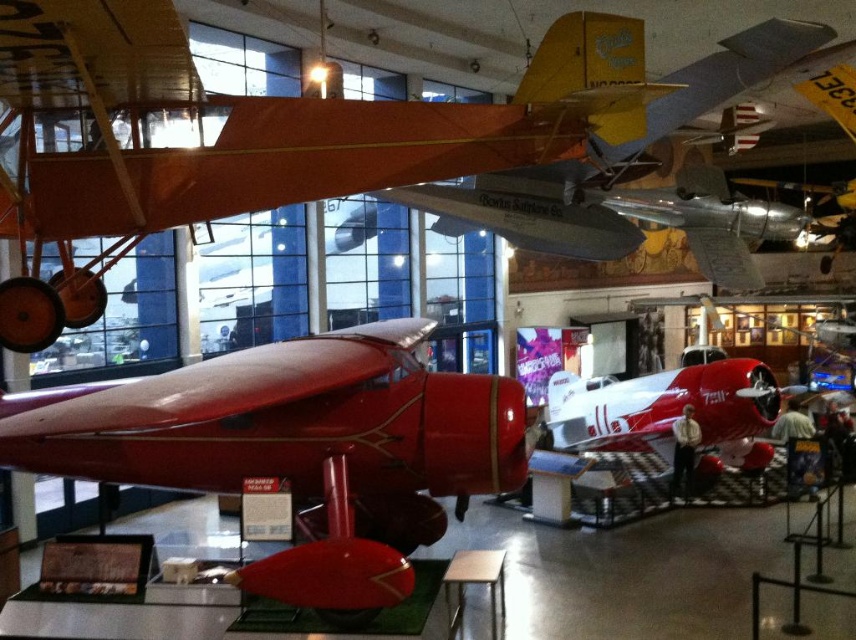
Does glossy red airplane at center have a greater width compared to matte red airplane at center?

Correct, the width of glossy red airplane at center exceeds that of matte red airplane at center.

Does glossy red airplane at center appear over matte red airplane at center?

Actually, glossy red airplane at center is below matte red airplane at center.

Which is in front, point (375, 413) or point (128, 208)?

Point (128, 208) is in front.

You are a GUI agent. You are given a task and a screenshot of the screen. Output one action in this format:
    pyautogui.click(x=<x>, y=<y>)
    Task: Click on the glossy red airplane at center
    This screenshot has width=856, height=640.
    Given the screenshot: What is the action you would take?
    (299, 448)

Is point (110, 188) positioned after point (762, 464)?

No, (110, 188) is closer to viewer.

Can you confirm if matte red airplane at center is shorter than polished red airplane at center?

Incorrect, matte red airplane at center's height does not fall short of polished red airplane at center's.

Is point (236, 205) in front of point (718, 384)?

Yes, point (236, 205) is closer to viewer.

The height and width of the screenshot is (640, 856). Find the location of `matte red airplane at center`. matte red airplane at center is located at coordinates (220, 145).

Is point (373, 465) farther from camera compared to point (569, 424)?

No, (373, 465) is closer to viewer.

Find the location of a particular element. This screenshot has height=640, width=856. glossy red airplane at center is located at coordinates (299, 448).

Which is in front, point (515, 422) or point (556, 449)?

Point (515, 422) is in front.

Identify the location of glossy red airplane at center. (299, 448).